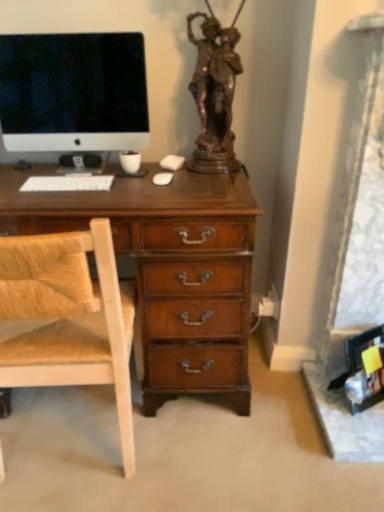
Question: From the image's perspective, relative to white matte keyboard at center, is white glossy computer monitor at upper left above or below?

Choices:
 (A) below
 (B) above

Answer: (B)

Question: From a real-world perspective, relative to white matte keyboard at center, is white glossy computer monitor at upper left vertically above or below?

Choices:
 (A) below
 (B) above

Answer: (B)

Question: Which object is positioned closest to the white matte keyboard at center?

Choices:
 (A) white glossy computer monitor at upper left
 (B) bronze statue at upper center
 (C) light brown wood chair at left

Answer: (A)

Question: Which object is positioned closest to the bronze statue at upper center?

Choices:
 (A) white matte keyboard at center
 (B) white glossy computer monitor at upper left
 (C) light brown wood chair at left

Answer: (B)